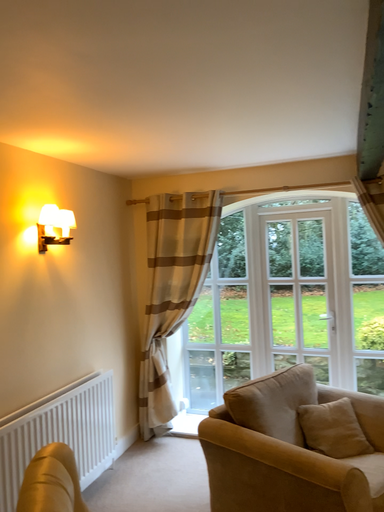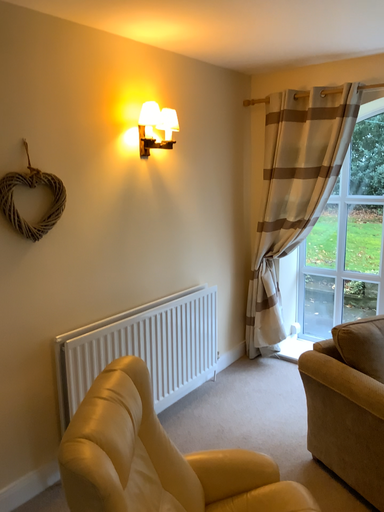
Question: Which way did the camera rotate in the video?

Choices:
 (A) rotated left
 (B) rotated right

Answer: (A)